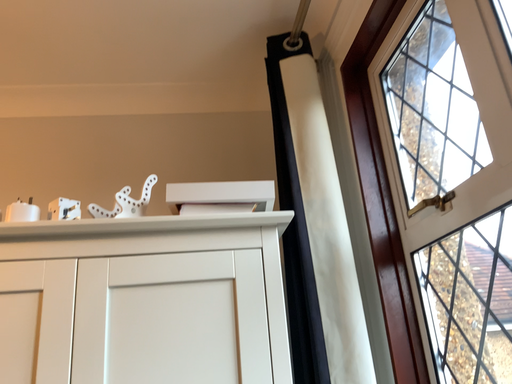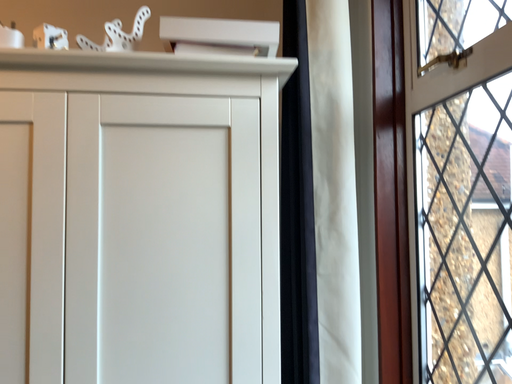
Question: Which way did the camera rotate in the video?

Choices:
 (A) rotated downward
 (B) rotated upward

Answer: (A)